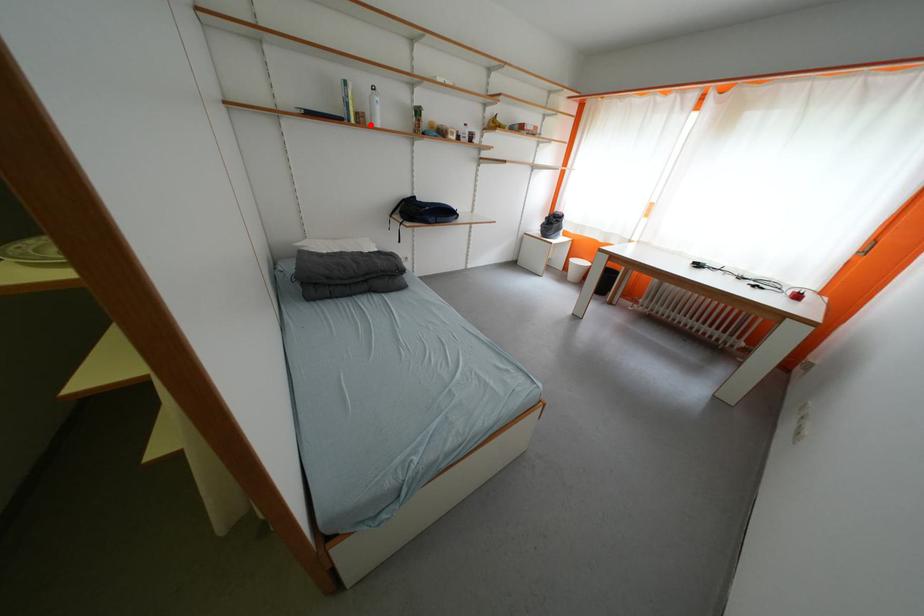
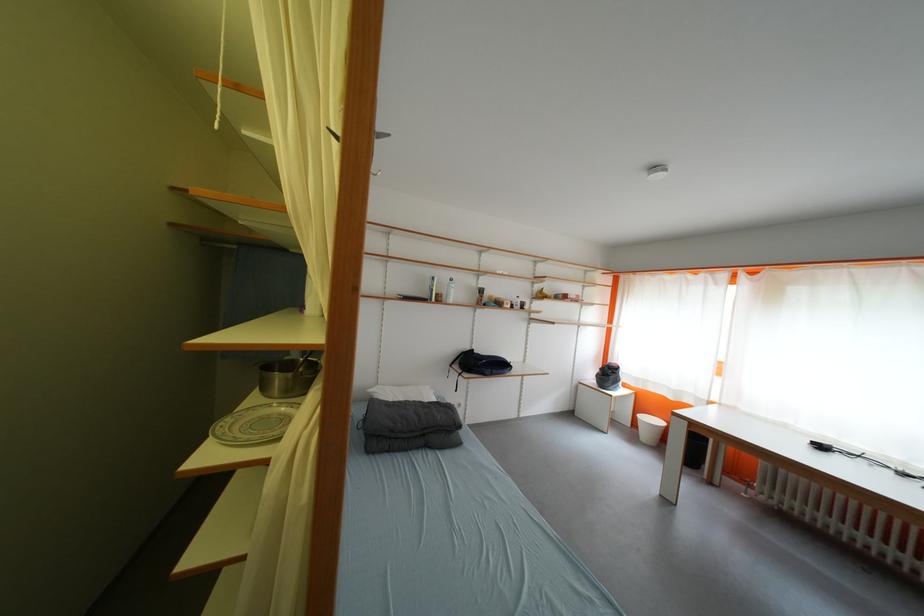
Where in the second image is the point corresponding to the highlighted location from the first image?

(447, 302)